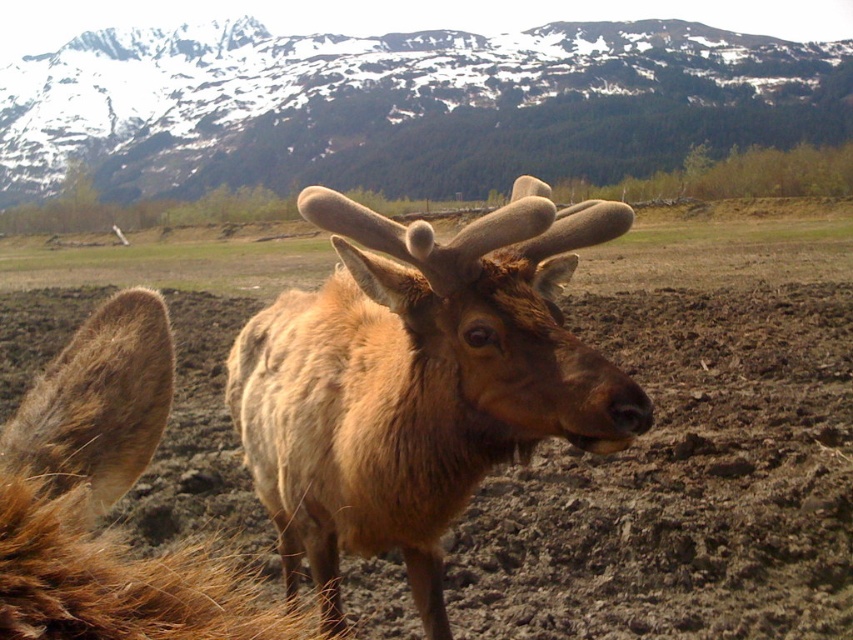
You are a photographer trying to capture the brown fuzzy deer at center and the brown muddy field at center in the same frame. Since both are at the center, how can you adjust your camera angle to ensure both are visible?

The brown muddy field at center is positioned on the right side of brown fuzzy deer at center, so you can angle your camera slightly to the right to include both the brown fuzzy deer at center and the brown muddy field at center in the frame.

You are a photographer aiming to capture the brown velvet antlers at center and the brown fuzzy deer at center in a single shot. Which object should you focus on first to ensure both are in sharp focus?

You should focus on the brown velvet antlers at center first because it is closer to the viewer than the brown fuzzy deer at center, ensuring both will be in focus when focusing on the closer object.

You are a wildlife photographer trying to capture the elk in the image. You want to ensure that the brown velvet antlers at center are centered in your photo. Given that the antlers are represented by the point at coordinates point (418, 381), will adjusting the camera to focus on this point ensure the antlers are centered?

Yes, since the brown velvet antlers at center are represented by the point at coordinates point (418, 381), adjusting the camera to focus on this point will center the antlers in the photo.